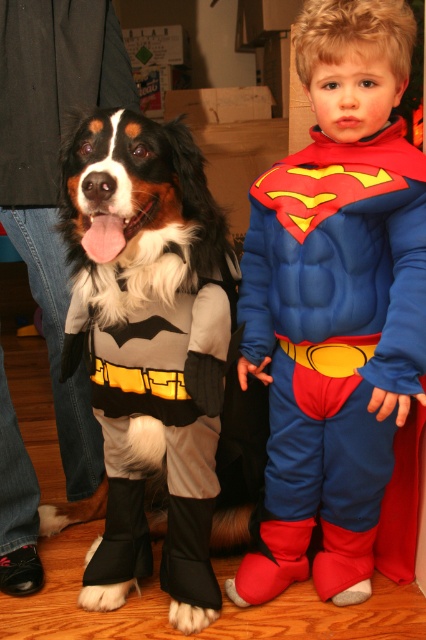
You are a photographer trying to capture a photo of the dog dressed in a Batman costume on the left and the child dressed as Superman on the right. You want to ensure that the focus is on the point at coordinates (336, 301). Based on the scene description, which costume element is this point likely part of?

The point at coordinates (336, 301) is on the blue fleece suit at center, which is part of the Superman costume worn by the child on the right.

You are a photographer trying to capture a clear photo of both the blue fleece suit at center and the fluffy fur dog at center. Which one should you focus on first to ensure it is in sharp focus?

You should focus on the blue fleece suit at center first because it is closer to you than the fluffy fur dog at center, so focusing on it first will ensure it stays sharp while adjusting for the other subject.

You are a photographer trying to capture a group photo of the blue fleece suit at center and the fluffy fur dog at center. If you want to ensure both subjects are fully visible in the frame, which subject should you position closer to the camera to maintain their proportions?

The blue fleece suit at center should be positioned closer to the camera because its width is larger than the fluffy fur dog at center, so moving it closer will help balance their sizes in the frame.